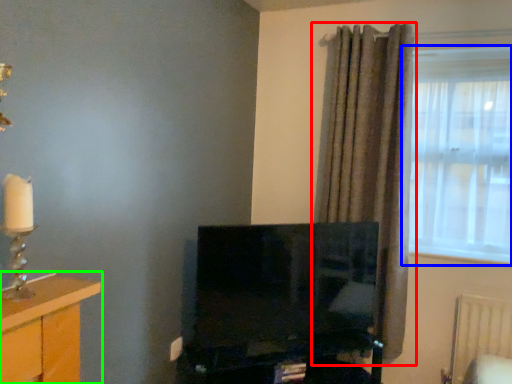
Question: Which is nearer to the curtain (highlighted by a red box)? window (highlighted by a blue box) or furniture (highlighted by a green box).

Choices:
 (A) window
 (B) furniture

Answer: (A)